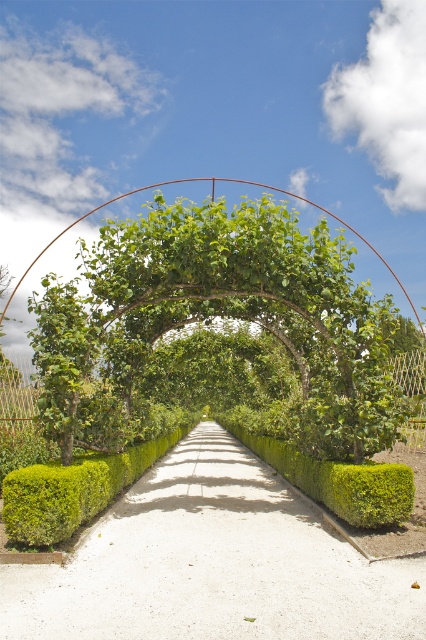
Which is more to the right, green hedge at center or green leafy tree at left?

green hedge at center is more to the right.

Is green hedge at center positioned before green leafy tree at left?

Yes, green hedge at center is in front of green leafy tree at left.

Where is `green hedge at center`? Image resolution: width=426 pixels, height=640 pixels. green hedge at center is located at coordinates (213, 563).

What do you see at coordinates (213, 563) in the screenshot? This screenshot has width=426, height=640. I see `green hedge at center` at bounding box center [213, 563].

Who is lower down, green hedge at center or green leafy hedge at center?

Positioned lower is green hedge at center.

Identify the location of green hedge at center. The image size is (426, 640). (213, 563).

Is point (376, 483) closer to camera compared to point (48, 282)?

Yes, it is.

Is green leafy hedge at center smaller than green leafy tree at left?

Actually, green leafy hedge at center might be larger than green leafy tree at left.

At what (x,y) coordinates should I click in order to perform the action: click on green leafy hedge at center. Please return your answer as a coordinate pair (x, y). This screenshot has height=640, width=426. Looking at the image, I should click on (337, 481).